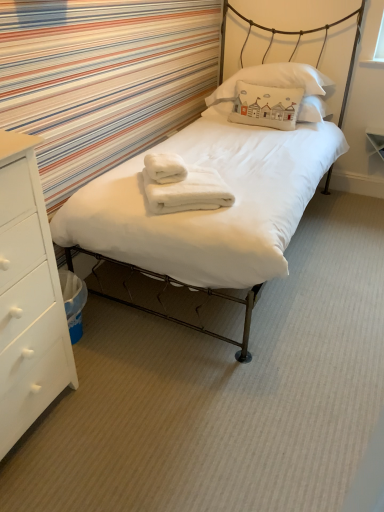
Question: Considering the positions of white fluffy bath towel at center, which appears as the first bath towel when ordered from the bottom, and white cotton pillow at upper center, the second pillow in the bottom-to-top sequence, in the image, is white fluffy bath towel at center, which appears as the first bath towel when ordered from the bottom, taller or shorter than white cotton pillow at upper center, the second pillow in the bottom-to-top sequence,?

Choices:
 (A) tall
 (B) short

Answer: (B)

Question: From a real-world perspective, is white fluffy bath towel at center, which ranks as the 2th bath towel in top-to-bottom order, positioned above or below white cotton pillow at upper center, the second pillow in the bottom-to-top sequence?

Choices:
 (A) above
 (B) below

Answer: (B)

Question: Which is farther from the white fluffy bath towel at center, which appears as the first bath towel when ordered from the bottom?

Choices:
 (A) white soft bed at center
 (B) white cotton pillow at upper center, which is counted as the 2th pillow, starting from the top
 (C) white fluffy bath towel at center, acting as the first bath towel starting from the top
 (D) white matte chest of drawers at left
 (E) white cotton pillow at upper center, the second pillow in the bottom-to-top sequence

Answer: (E)

Question: Which object is the farthest from the white cotton pillow at upper center, which is counted as the 2th pillow, starting from the top?

Choices:
 (A) white cotton pillow at upper center, the second pillow in the bottom-to-top sequence
 (B) white fluffy bath towel at center, which appears as the first bath towel when ordered from the bottom
 (C) white fluffy bath towel at center, acting as the first bath towel starting from the top
 (D) white soft bed at center
 (E) white matte chest of drawers at left

Answer: (E)